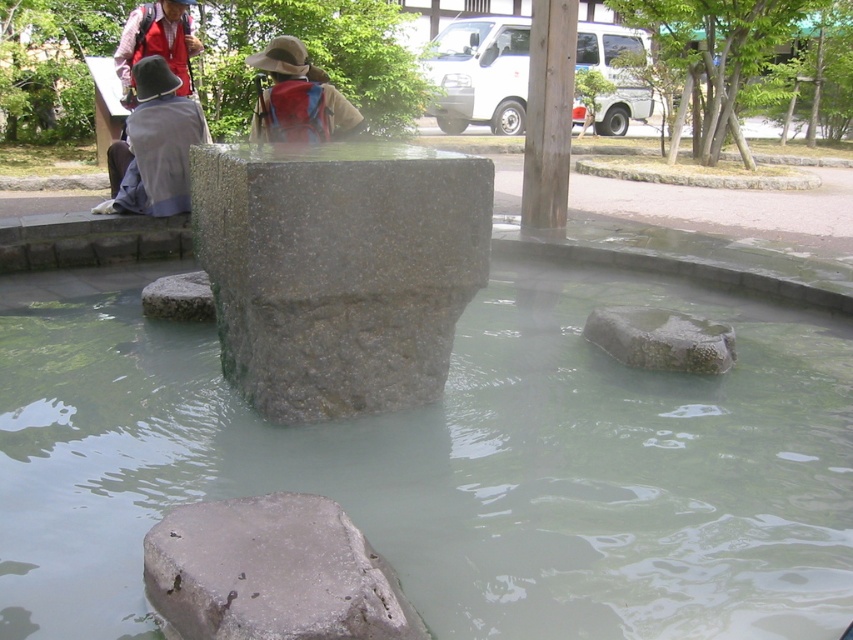
Can you confirm if gray rough stone at lower center is positioned below granite rock at center?

Yes.

Does gray rough stone at lower center appear on the left side of granite rock at center?

No, gray rough stone at lower center is not to the left of granite rock at center.

Does point (215, 509) come closer to viewer compared to point (142, 310)?

Yes.

The height and width of the screenshot is (640, 853). What are the coordinates of `gray rough stone at lower center` in the screenshot? It's located at (271, 573).

Is gray granite stone at center thinner than smooth gray stone at center?

No, gray granite stone at center is not thinner than smooth gray stone at center.

Is point (404, 387) behind point (718, 326)?

No.

Identify the location of gray granite stone at center. The image size is (853, 640). (338, 269).

Consider the image. Is gray granite stone at center shorter than granite rock at center?

No.

Is gray granite stone at center taller than granite rock at center?

Indeed, gray granite stone at center has a greater height compared to granite rock at center.

Identify the location of gray granite stone at center. (338, 269).